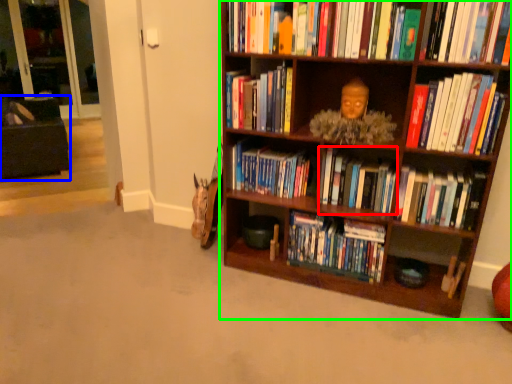
Question: Which object is the closest to the book (highlighted by a red box)? Choose among these: bean bag chair (highlighted by a blue box) or bookcase (highlighted by a green box).

Choices:
 (A) bean bag chair
 (B) bookcase

Answer: (B)